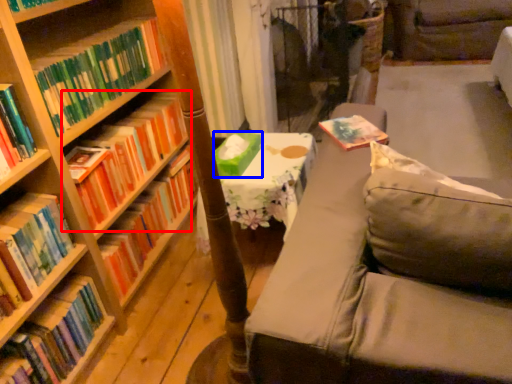
Question: Among these objects, which one is farthest to the camera, book (highlighted by a red box) or paperback book (highlighted by a blue box)?

Choices:
 (A) book
 (B) paperback book

Answer: (B)